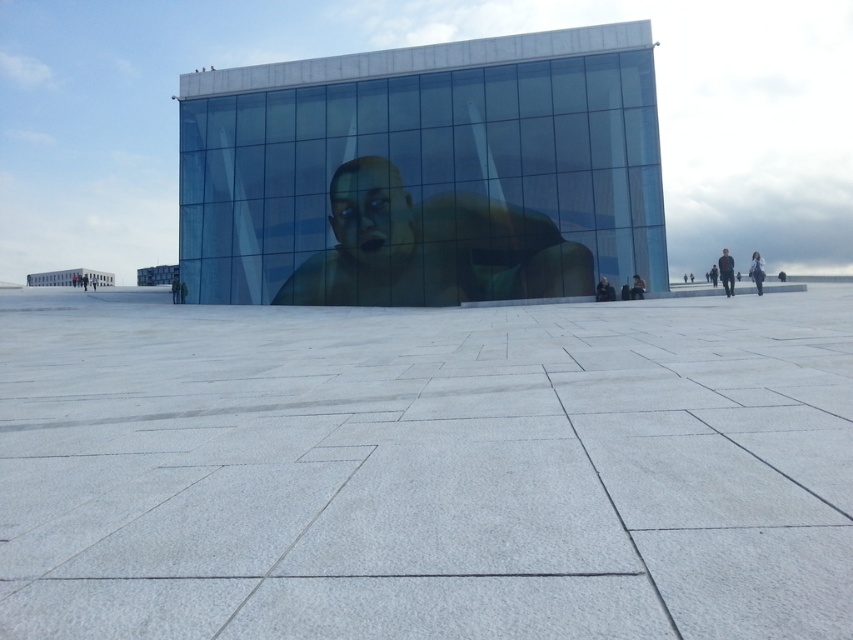
Can you confirm if white polished stone plaza at center is positioned above smooth green face at center?

No, white polished stone plaza at center is not above smooth green face at center.

Between point (425, 529) and point (334, 220), which one is positioned behind?

The point (334, 220) is more distant.

Find the location of a particular element. The image size is (853, 640). white polished stone plaza at center is located at coordinates (426, 468).

From the picture: Can you confirm if green matte mask at center is positioned above smooth green face at center?

No, green matte mask at center is not above smooth green face at center.

Is the position of green matte mask at center more distant than that of smooth green face at center?

No, it is in front of smooth green face at center.

Image resolution: width=853 pixels, height=640 pixels. What do you see at coordinates (431, 248) in the screenshot?
I see `green matte mask at center` at bounding box center [431, 248].

Locate an element on the screen. The height and width of the screenshot is (640, 853). green matte mask at center is located at coordinates (431, 248).

Between green matte mask at center and dark gray fabric jacket at center, which one has less height?

dark gray fabric jacket at center

Between point (432, 250) and point (606, 280), which one is positioned behind?

Positioned behind is point (432, 250).

At what (x,y) coordinates should I click in order to perform the action: click on green matte mask at center. Please return your answer as a coordinate pair (x, y). Image resolution: width=853 pixels, height=640 pixels. Looking at the image, I should click on (431, 248).